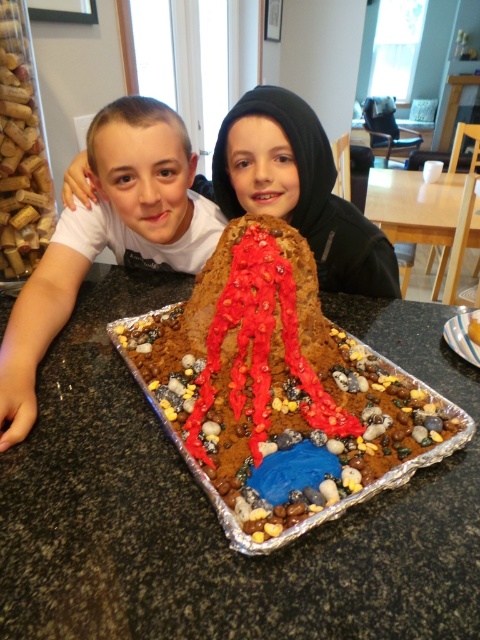
You are a photographer trying to capture the chocolate cake at center for a food blog. The camera is positioned at point A, which is at coordinates 0.5,0.5. To frame the cake perfectly, you need to adjust the camera to the exact coordinates of the chocolate cake. What are the coordinates you should set your camera to?

The chocolate cake at center is located at point [280,390], so you should set the camera to those coordinates to frame it perfectly.

Based on the scene described, can the chocolate cake at center fit on the light brown wooden table at upper right without needing to be resized?

The chocolate cake at center is smaller than the light brown wooden table at upper right, so it can fit on the table without needing to be resized.